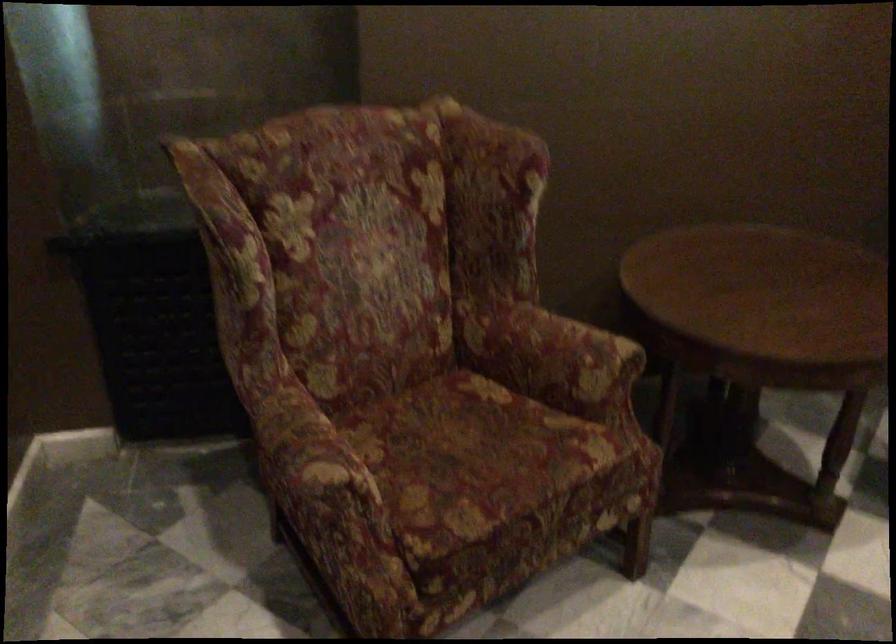
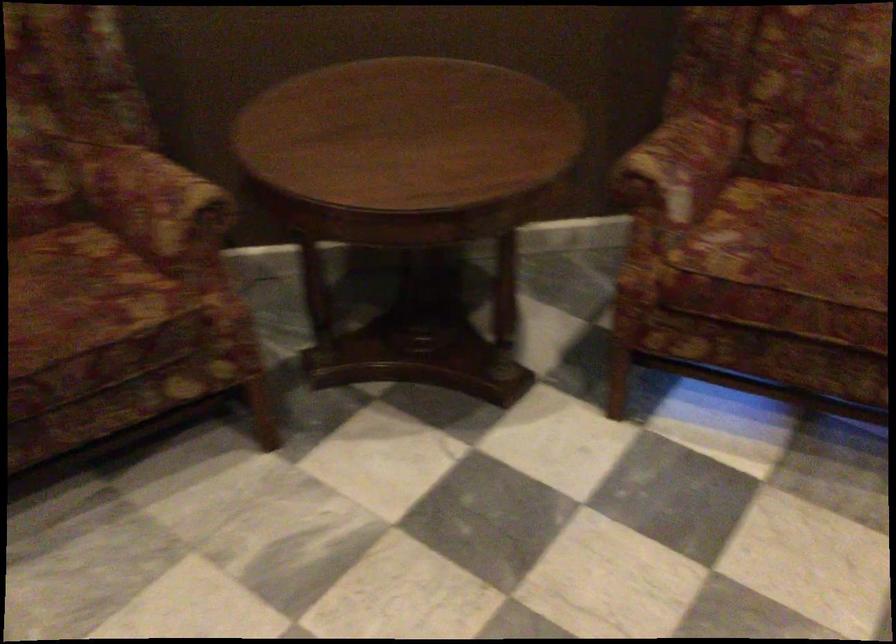
Question: The images are taken continuously from a first-person perspective. In which direction is your viewpoint rotating?

Choices:
 (A) Left
 (B) Right
 (C) Up
 (D) Down

Answer: (D)